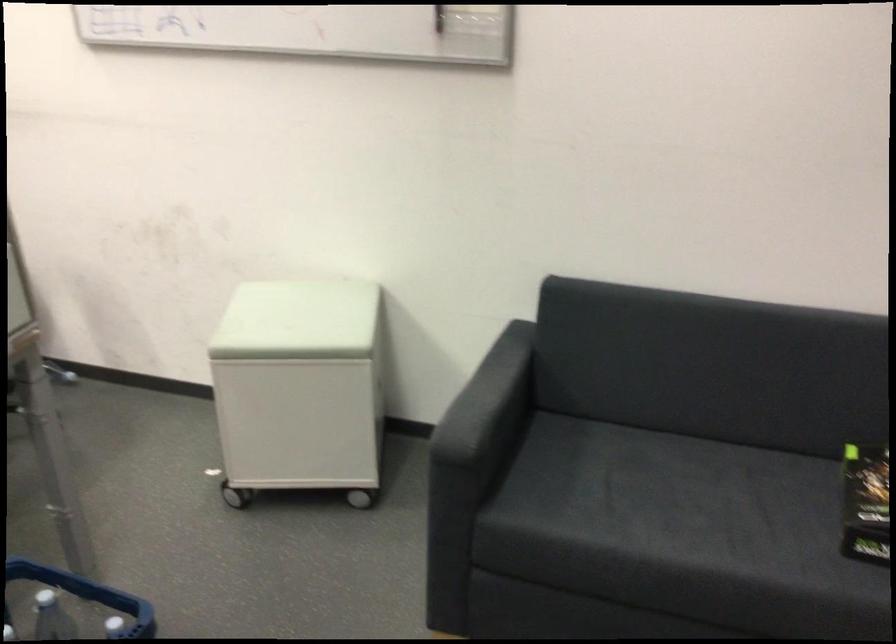
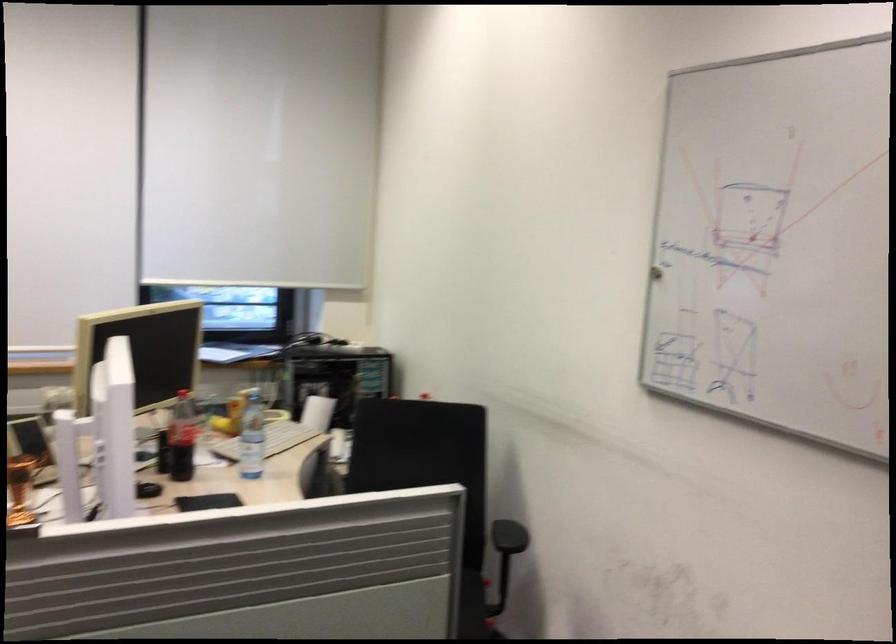
Question: The camera is either moving clockwise (left) or counter-clockwise (right) around the object. The first image is from the beginning of the video and the second image is from the end. Is the camera moving left or right when shooting the video?

Choices:
 (A) Left
 (B) Right

Answer: (B)